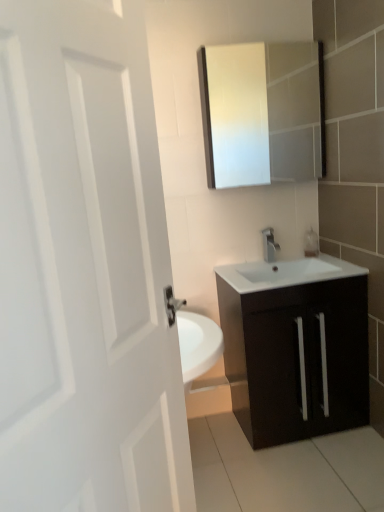
Find the location of `vacant space to the left of clear glass soap dispenser at right`. vacant space to the left of clear glass soap dispenser at right is located at coordinates (288, 260).